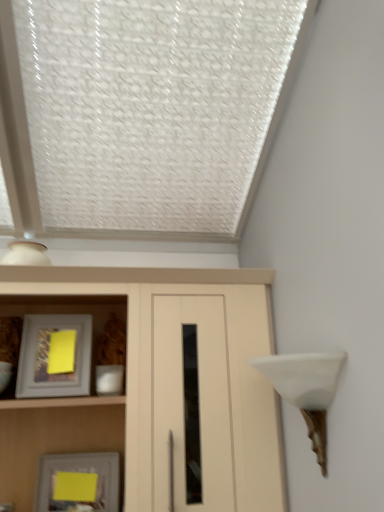
Question: Should I look upward or downward to see matte gray picture frame at left, the 2th picture frame in the bottom-to-top sequence?

Choices:
 (A) down
 (B) up

Answer: (A)

Question: Is yellow paper at lower left, positioned as the 2th picture frame in top-to-bottom order, located outside matte wood cupboard at center?

Choices:
 (A) no
 (B) yes

Answer: (A)

Question: Is the position of yellow paper at lower left, acting as the first picture frame starting from the bottom, more distant than that of matte wood cupboard at center?

Choices:
 (A) no
 (B) yes

Answer: (B)

Question: Could matte wood cupboard at center be considered to be inside yellow paper at lower left, positioned as the 2th picture frame in top-to-bottom order?

Choices:
 (A) yes
 (B) no

Answer: (B)

Question: Is yellow paper at lower left, acting as the first picture frame starting from the bottom, with matte wood cupboard at center?

Choices:
 (A) no
 (B) yes

Answer: (A)

Question: Can you confirm if yellow paper at lower left, acting as the first picture frame starting from the bottom, is wider than matte wood cupboard at center?

Choices:
 (A) no
 (B) yes

Answer: (A)

Question: From a real-world perspective, is yellow paper at lower left, acting as the first picture frame starting from the bottom, on matte wood cupboard at center?

Choices:
 (A) no
 (B) yes

Answer: (A)

Question: Considering the relative sizes of matte wood cupboard at center and white matte table lamp at right in the image provided, is matte wood cupboard at center bigger than white matte table lamp at right?

Choices:
 (A) yes
 (B) no

Answer: (A)

Question: Would you consider matte wood cupboard at center to be distant from white matte table lamp at right?

Choices:
 (A) no
 (B) yes

Answer: (A)

Question: Is matte wood cupboard at center positioned beyond the bounds of white matte table lamp at right?

Choices:
 (A) no
 (B) yes

Answer: (B)

Question: Is matte wood cupboard at center beside white matte table lamp at right?

Choices:
 (A) no
 (B) yes

Answer: (A)

Question: Is matte wood cupboard at center closer to the viewer compared to white matte table lamp at right?

Choices:
 (A) yes
 (B) no

Answer: (B)

Question: From a real-world perspective, is matte wood cupboard at center physically below white matte table lamp at right?

Choices:
 (A) yes
 (B) no

Answer: (B)

Question: Is matte gray picture frame at left, the 2th picture frame in the bottom-to-top sequence, surrounded by yellow paper at lower left, positioned as the 2th picture frame in top-to-bottom order?

Choices:
 (A) no
 (B) yes

Answer: (A)